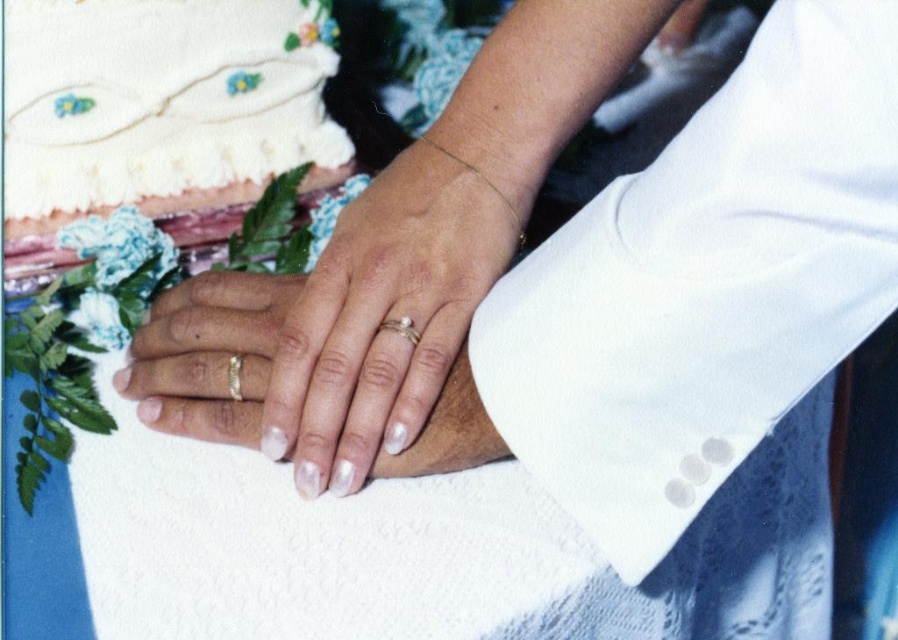
Can you confirm if white frosted cake at upper left is shorter than white matte ring at center?

Incorrect, white frosted cake at upper left's height does not fall short of white matte ring at center's.

Image resolution: width=898 pixels, height=640 pixels. In order to click on white frosted cake at upper left in this screenshot , I will do click(159, 113).

Can you confirm if white matte ring at center is shorter than gold metallic ring at center?

No, white matte ring at center is not shorter than gold metallic ring at center.

Does white matte ring at center have a greater height compared to gold metallic ring at center?

Yes, white matte ring at center is taller than gold metallic ring at center.

Measure the distance between point [305,300] and camera.

A distance of 21.53 inches exists between point [305,300] and camera.

I want to click on white matte ring at center, so click(393, 308).

Who is lower down, gold metallic ring at center or silver metallic ring at center?

gold metallic ring at center is lower down.

Who is higher up, gold metallic ring at center or silver metallic ring at center?

silver metallic ring at center

Describe the element at coordinates (208, 355) in the screenshot. I see `gold metallic ring at center` at that location.

Where is `gold metallic ring at center`? gold metallic ring at center is located at coordinates (208, 355).